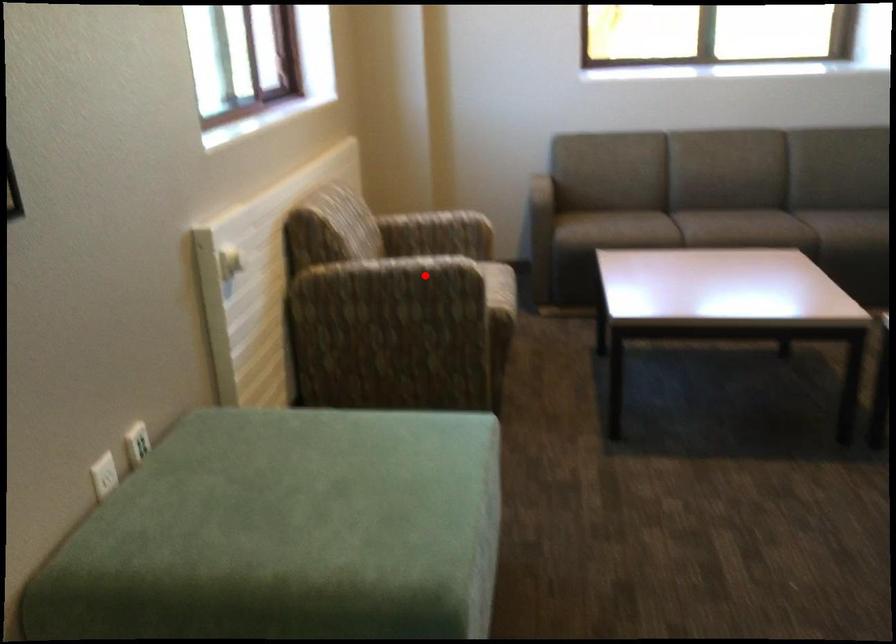
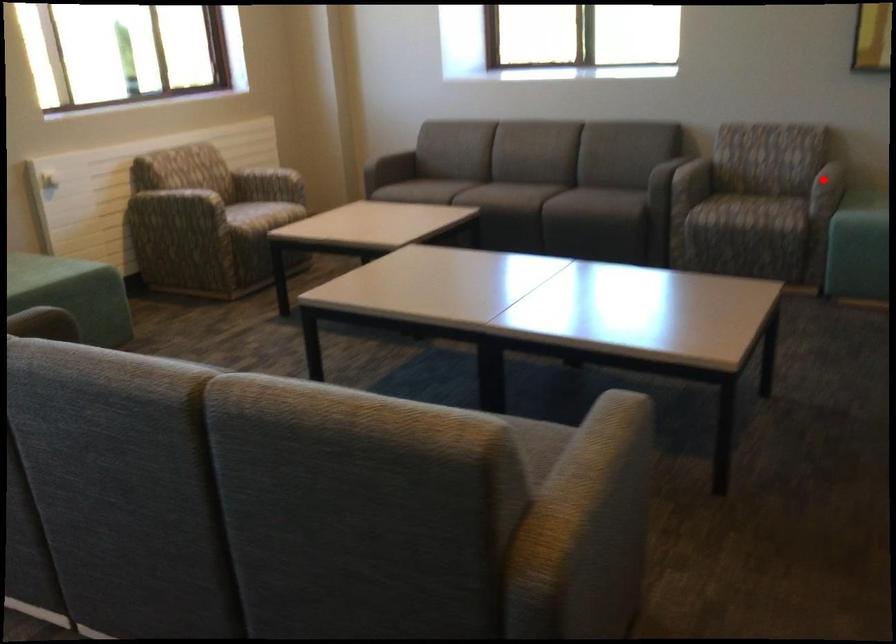
I am providing you with two images of the same scene from different viewpoints. A red point is marked on the first image and another point is marked on the second image. Are the points marked in image1 and image2 representing the same 3D position?

No